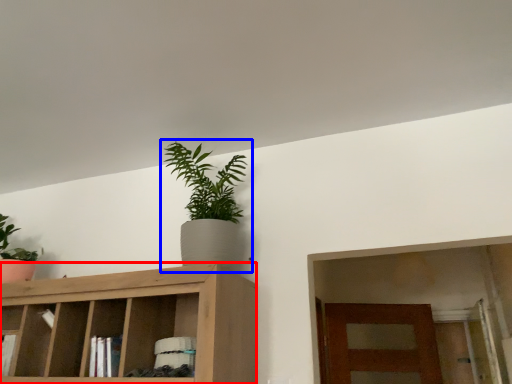
Question: Which of the following is the farthest to the observer, cabinetry (highlighted by a red box) or houseplant (highlighted by a blue box)?

Choices:
 (A) cabinetry
 (B) houseplant

Answer: (B)